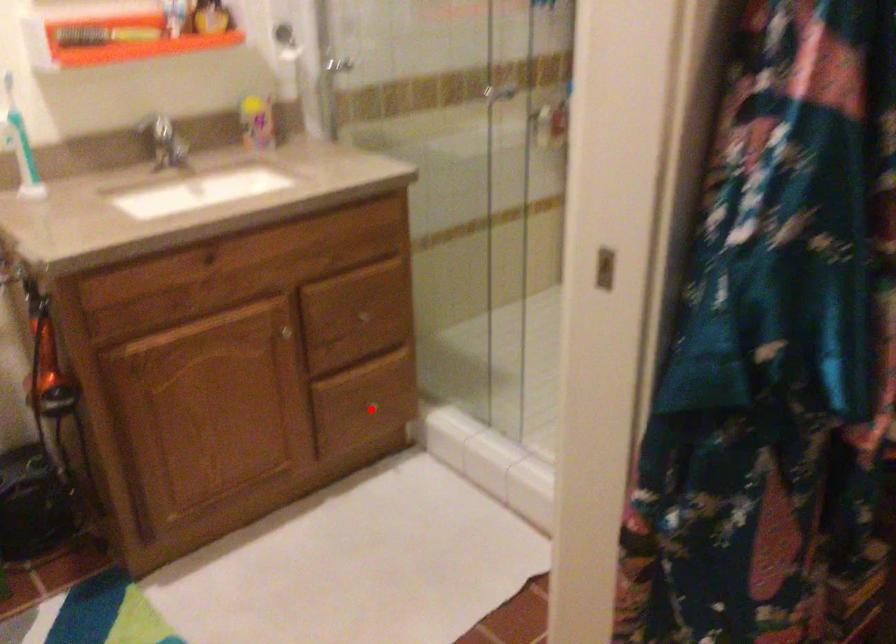
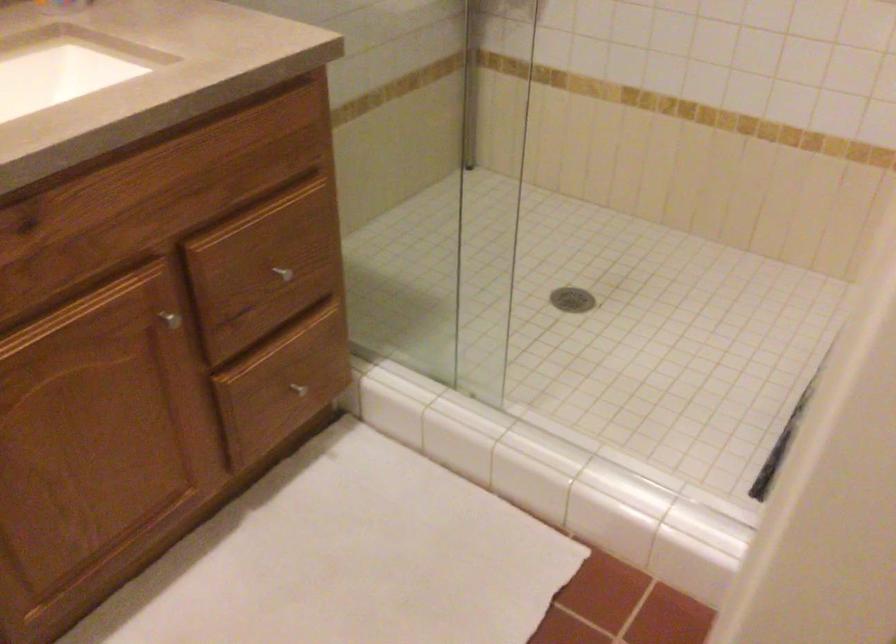
Question: I am providing you with two images of the same scene from different viewpoints. A red point is shown in image1. For the corresponding object point in image2, is it positioned nearer or farther from the camera?

Choices:
 (A) Nearer
 (B) Farther

Answer: (A)